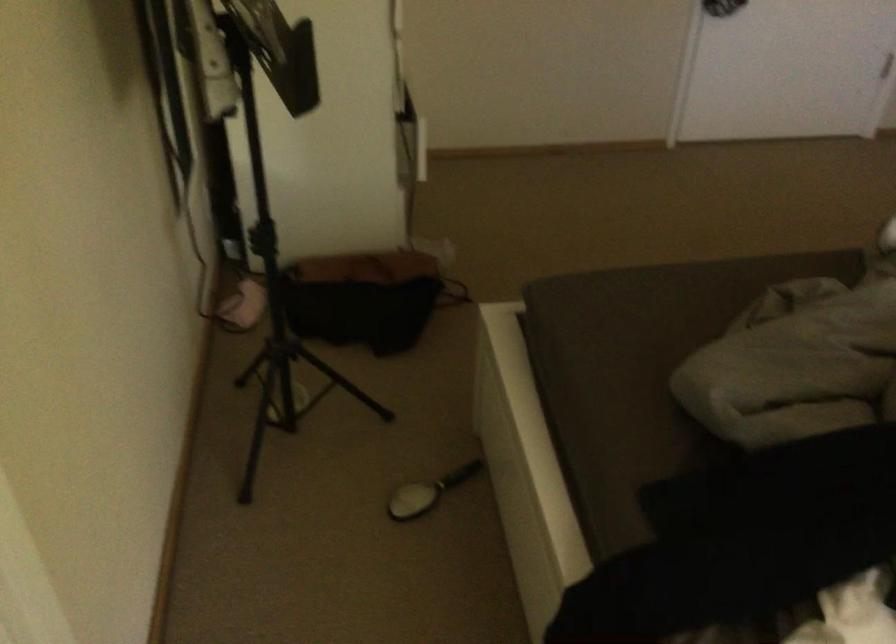
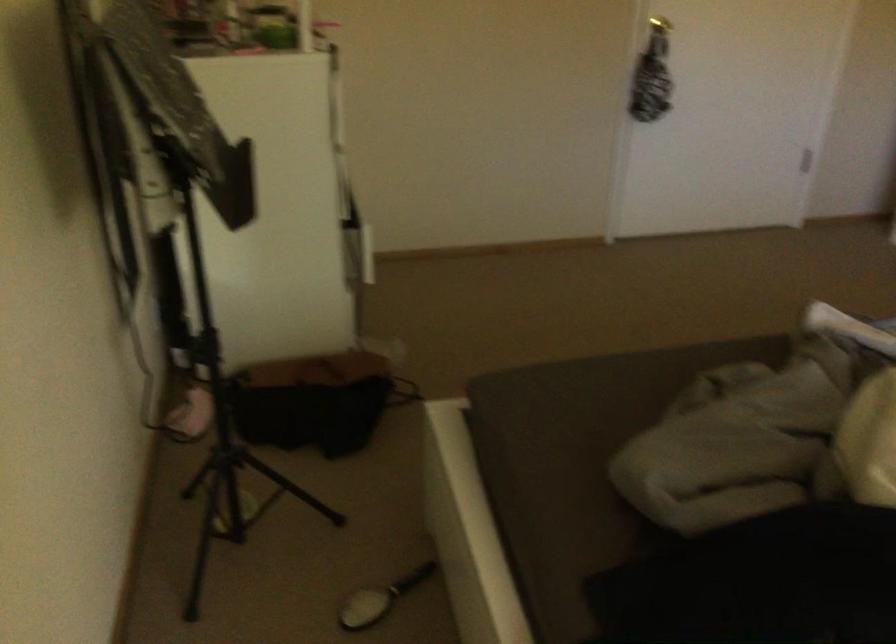
Question: The first image is from the beginning of the video and the second image is from the end. How did the camera likely rotate when shooting the video?

Choices:
 (A) Left
 (B) Right
 (C) Up
 (D) Down

Answer: (C)